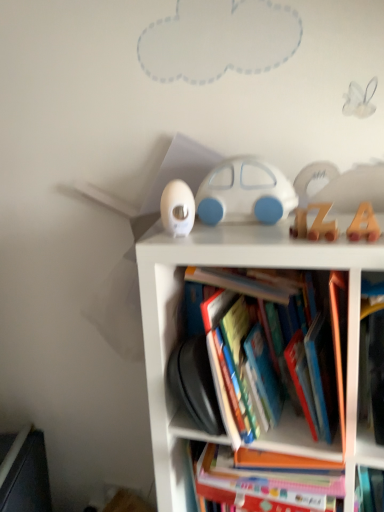
Question: Is white plastic bookcase at center with white plastic thermometer at upper left, acting as the second toy starting from the back?

Choices:
 (A) yes
 (B) no

Answer: (B)

Question: Considering the relative positions of white plastic bookcase at center and white plastic thermometer at upper left, the third toy from the front, in the image provided, is white plastic bookcase at center in front of white plastic thermometer at upper left, the third toy from the front,?

Choices:
 (A) yes
 (B) no

Answer: (A)

Question: Is white plastic thermometer at upper left, acting as the second toy starting from the back, at the back of white plastic bookcase at center?

Choices:
 (A) no
 (B) yes

Answer: (A)

Question: Is white plastic bookcase at center shorter than white plastic thermometer at upper left, acting as the second toy starting from the back?

Choices:
 (A) no
 (B) yes

Answer: (A)

Question: Can you confirm if white plastic bookcase at center is positioned to the right of white plastic thermometer at upper left, the third toy from the front?

Choices:
 (A) yes
 (B) no

Answer: (A)

Question: Relative to white plastic bookcase at center, is wooden letter a at upper right, placed as the 4th toy when sorted from back to front, in front or behind?

Choices:
 (A) behind
 (B) front

Answer: (A)

Question: Visually, is wooden letter a at upper right, placed as the 4th toy when sorted from back to front, positioned to the left or to the right of white plastic bookcase at center?

Choices:
 (A) right
 (B) left

Answer: (A)

Question: From a real-world perspective, is wooden letter a at upper right, placed as the 4th toy when sorted from back to front, physically located above or below white plastic bookcase at center?

Choices:
 (A) above
 (B) below

Answer: (A)

Question: Considering the positions of point (347, 229) and point (271, 256), is point (347, 229) closer or farther from the camera than point (271, 256)?

Choices:
 (A) farther
 (B) closer

Answer: (A)

Question: Considering their positions, is wooden letter a at upper right, placed as the 4th toy when sorted from back to front, located in front of or behind white plastic thermometer at upper left, the third toy from the front?

Choices:
 (A) front
 (B) behind

Answer: (A)

Question: From their relative heights in the image, would you say wooden letter a at upper right, the first toy positioned from the front, is taller or shorter than white plastic thermometer at upper left, the third toy from the front?

Choices:
 (A) tall
 (B) short

Answer: (B)

Question: From the image's perspective, is wooden letter a at upper right, the first toy positioned from the front, positioned above or below white plastic thermometer at upper left, acting as the second toy starting from the back?

Choices:
 (A) above
 (B) below

Answer: (B)

Question: Considering the positions of wooden letter a at upper right, the first toy positioned from the front, and white plastic thermometer at upper left, the third toy from the front, in the image, is wooden letter a at upper right, the first toy positioned from the front, bigger or smaller than white plastic thermometer at upper left, the third toy from the front,?

Choices:
 (A) big
 (B) small

Answer: (B)

Question: Visually, is white plastic thermometer at upper left, the third toy from the front, positioned to the left or to the right of white matte car at center, positioned as the first toy in back-to-front order?

Choices:
 (A) left
 (B) right

Answer: (A)

Question: From a real-world perspective, is white plastic thermometer at upper left, acting as the second toy starting from the back, positioned above or below white matte car at center, placed as the 4th toy when sorted from front to back?

Choices:
 (A) above
 (B) below

Answer: (B)